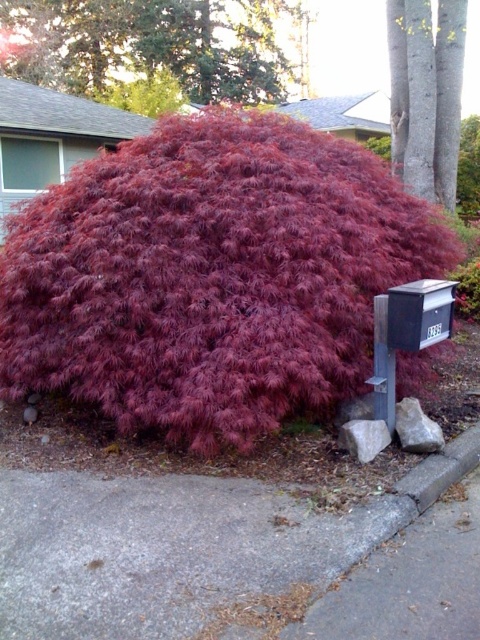
Between point (80, 13) and point (444, 317), which one is positioned in front?

Positioned in front is point (444, 317).

Is shiny red leaves at upper center bigger than black matte mailbox at right?

Correct, shiny red leaves at upper center is larger in size than black matte mailbox at right.

This screenshot has height=640, width=480. What do you see at coordinates (151, 44) in the screenshot?
I see `shiny red leaves at upper center` at bounding box center [151, 44].

Find the location of `shiny red leaves at upper center`. shiny red leaves at upper center is located at coordinates (151, 44).

This screenshot has height=640, width=480. What do you see at coordinates (211, 276) in the screenshot?
I see `purple matte maple at center` at bounding box center [211, 276].

Between purple matte maple at center and black matte mailbox at right, which one is positioned higher?

purple matte maple at center is higher up.

Where is `purple matte maple at center`? purple matte maple at center is located at coordinates (211, 276).

Where is `purple matte maple at center`? Image resolution: width=480 pixels, height=640 pixels. purple matte maple at center is located at coordinates (211, 276).

Is point (264, 150) behind point (397, 108)?

No, it is not.

Is point (287, 252) positioned after point (459, 19)?

No, (287, 252) is in front of (459, 19).

You are a GUI agent. You are given a task and a screenshot of the screen. Output one action in this format:
    pyautogui.click(x=<x>, y=<y>)
    Task: Click on the purple matte maple at center
    Image resolution: width=480 pixels, height=640 pixels.
    Given the screenshot: What is the action you would take?
    pyautogui.click(x=211, y=276)